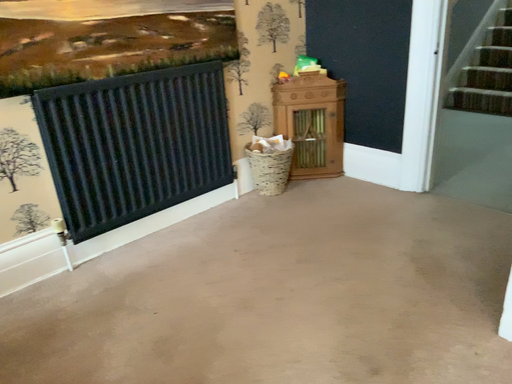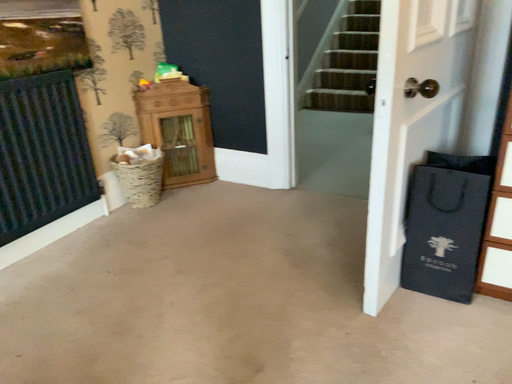
Question: How did the camera likely rotate when shooting the video?

Choices:
 (A) rotated right
 (B) rotated left

Answer: (A)